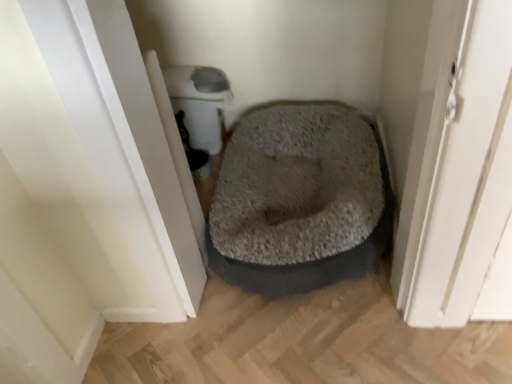
Question: Should I look upward or downward to see white glossy screen door at left?

Choices:
 (A) up
 (B) down

Answer: (A)

Question: Is gray plush dog bed at center thinner than white glossy screen door at left?

Choices:
 (A) yes
 (B) no

Answer: (B)

Question: Can you confirm if gray plush dog bed at center is shorter than white glossy screen door at left?

Choices:
 (A) no
 (B) yes

Answer: (B)

Question: Is the depth of gray plush dog bed at center greater than that of white glossy screen door at left?

Choices:
 (A) no
 (B) yes

Answer: (B)

Question: Considering the relative sizes of gray plush dog bed at center and white glossy screen door at left in the image provided, is gray plush dog bed at center smaller than white glossy screen door at left?

Choices:
 (A) yes
 (B) no

Answer: (B)

Question: From the image's perspective, does gray plush dog bed at center appear higher than white glossy screen door at left?

Choices:
 (A) yes
 (B) no

Answer: (B)

Question: Is gray plush dog bed at center to the left of white glossy screen door at left from the viewer's perspective?

Choices:
 (A) yes
 (B) no

Answer: (B)

Question: Is the depth of white glossy screen door at left less than that of gray plush dog bed at center?

Choices:
 (A) no
 (B) yes

Answer: (B)

Question: Would you say white glossy screen door at left is outside gray plush dog bed at center?

Choices:
 (A) no
 (B) yes

Answer: (B)

Question: Is gray plush dog bed at center located within white glossy screen door at left?

Choices:
 (A) yes
 (B) no

Answer: (B)

Question: Is white glossy screen door at left shorter than gray plush dog bed at center?

Choices:
 (A) yes
 (B) no

Answer: (B)

Question: Does white glossy screen door at left have a larger size compared to gray plush dog bed at center?

Choices:
 (A) yes
 (B) no

Answer: (B)

Question: From the image's perspective, is white glossy screen door at left over gray plush dog bed at center?

Choices:
 (A) no
 (B) yes

Answer: (B)

Question: From a real-world perspective, is gray plush dog bed at center physically located above or below white glossy screen door at left?

Choices:
 (A) above
 (B) below

Answer: (B)